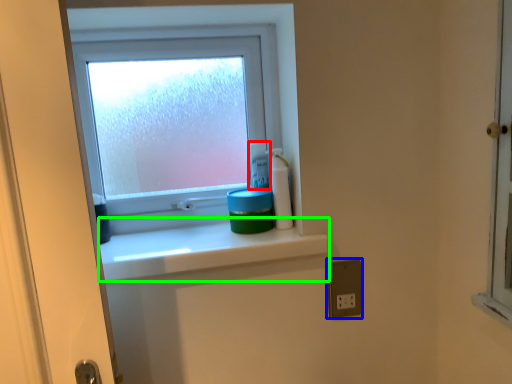
Question: Considering the real-world distances, which object is closest to toiletry (highlighted by a red box)? electric outlet (highlighted by a blue box) or window sill (highlighted by a green box).

Choices:
 (A) electric outlet
 (B) window sill

Answer: (B)